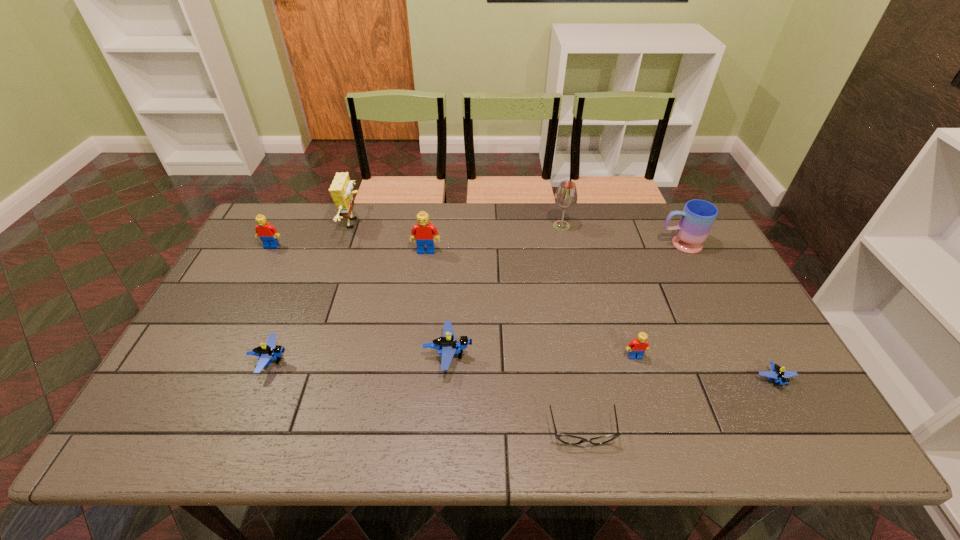
Where is `the eighth object from left to right`? This screenshot has width=960, height=540. the eighth object from left to right is located at coordinates (637, 347).

Where is `the fifth Lego from right to left`? The image size is (960, 540). the fifth Lego from right to left is located at coordinates (266, 352).

Image resolution: width=960 pixels, height=540 pixels. I want to click on the eighth tallest object, so click(266, 352).

Identify the location of the rightmost Lego. The width and height of the screenshot is (960, 540). (781, 377).

I want to click on the rightmost blue Lego, so click(x=781, y=377).

The image size is (960, 540). I want to click on spectacles, so click(x=564, y=438).

At what (x,y) coordinates should I click in order to perform the action: click on the nearest object. Please return your answer as a coordinate pair (x, y). This screenshot has width=960, height=540. Looking at the image, I should click on (564, 438).

Find the location of a particular element. This screenshot has height=540, width=960. vacant space located on the face of the sponge is located at coordinates (420, 224).

This screenshot has height=540, width=960. Identify the location of vacant area situated on the left of the wineglass. (527, 226).

You are a GUI agent. You are given a task and a screenshot of the screen. Output one action in this format:
    pyautogui.click(x=<x>, y=<y>)
    Task: Click on the free space located on the face of the second red Lego from right to left
    The width and height of the screenshot is (960, 540).
    Given the screenshot: What is the action you would take?
    pyautogui.click(x=415, y=337)